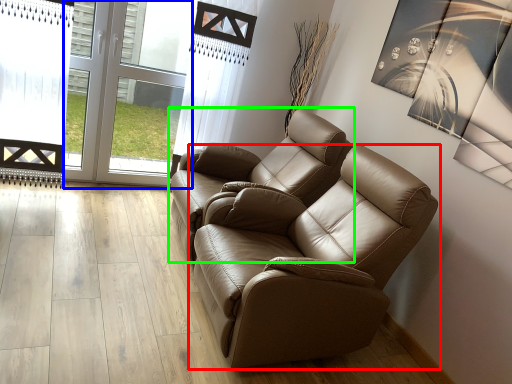
Question: Considering the real-world distances, which object is closest to chair (highlighted by a red box)? glass door (highlighted by a blue box) or chair (highlighted by a green box).

Choices:
 (A) glass door
 (B) chair

Answer: (B)